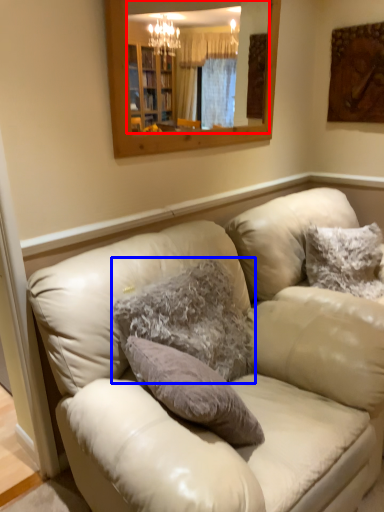
Question: Which of the following is the farthest to the observer, mirror (highlighted by a red box) or pillow (highlighted by a blue box)?

Choices:
 (A) mirror
 (B) pillow

Answer: (A)